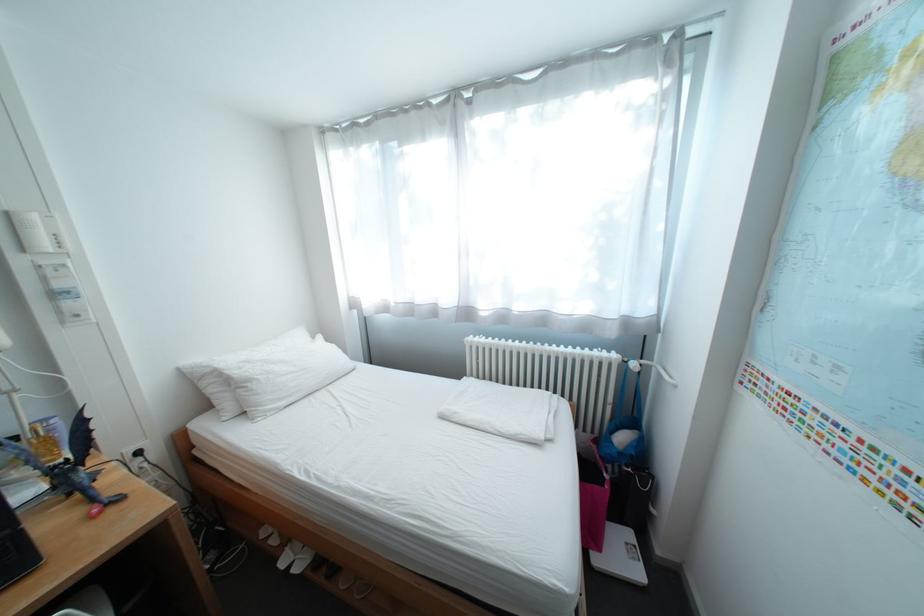
The height and width of the screenshot is (616, 924). Find the location of `radiator handle`. radiator handle is located at coordinates (648, 368).